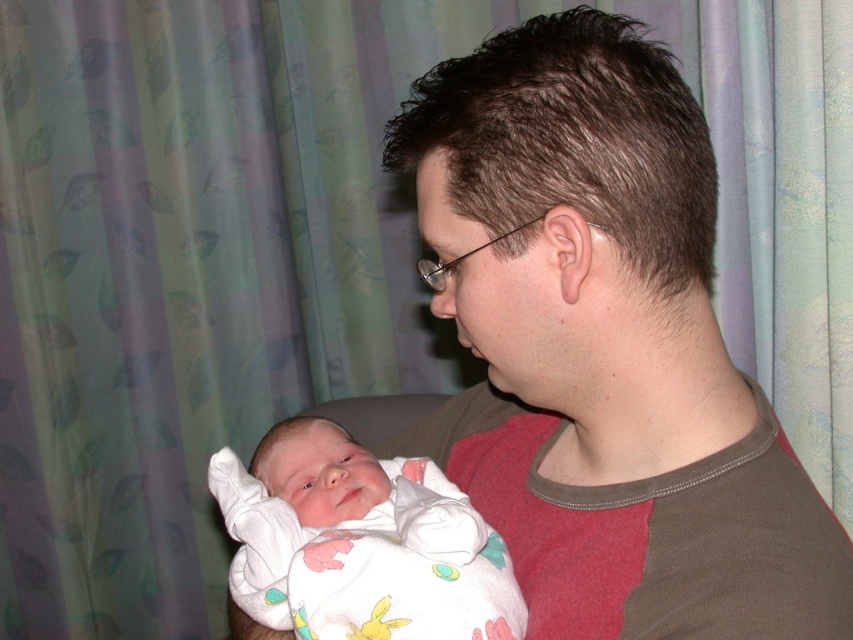
Is brown cotton shirt at center below white soft fabric newborn at center?

No.

Does point (521, 360) lie behind point (347, 550)?

No, it is not.

What do you see at coordinates (605, 348) in the screenshot?
I see `brown cotton shirt at center` at bounding box center [605, 348].

The height and width of the screenshot is (640, 853). Find the location of `brown cotton shirt at center`. brown cotton shirt at center is located at coordinates (605, 348).